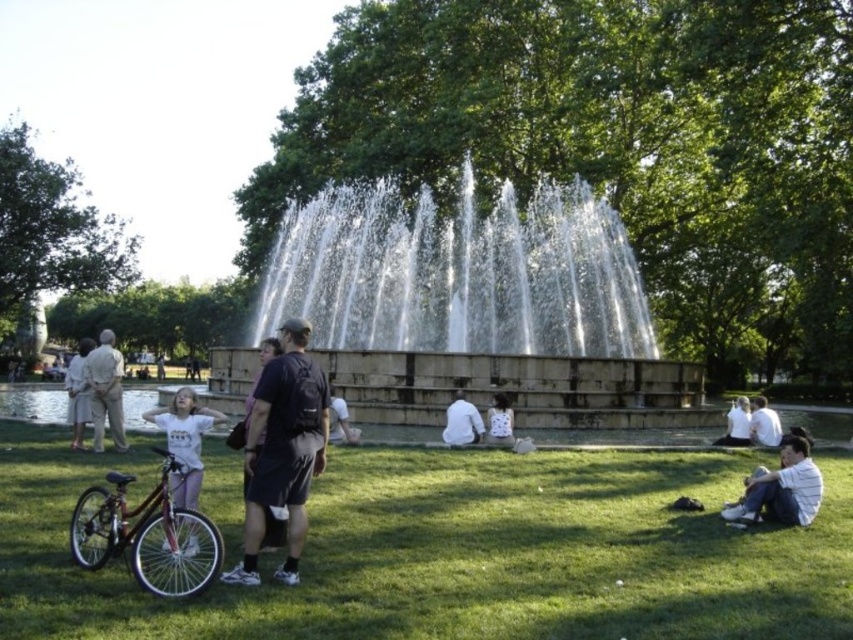
Question: Is white matte shirt at lower left thinner than white cotton shirt at center?

Choices:
 (A) no
 (B) yes

Answer: (A)

Question: Does green grass at lower center appear on the left side of shiny metallic bicycle at lower left?

Choices:
 (A) no
 (B) yes

Answer: (A)

Question: Which point is closer to the camera?

Choices:
 (A) tap(517, 282)
 (B) tap(461, 440)
 (C) tap(201, 476)

Answer: (C)

Question: Which point is farther from the camera taking this photo?

Choices:
 (A) (91, 401)
 (B) (135, 524)

Answer: (A)

Question: Estimate the real-world distances between objects in this image. Which object is closer to the black fabric backpack at center?

Choices:
 (A) white stone fountain at center
 (B) white cotton shirt at center

Answer: (B)

Question: Can you confirm if white stone fountain at center is positioned to the right of shiny metallic bicycle at lower left?

Choices:
 (A) yes
 (B) no

Answer: (A)